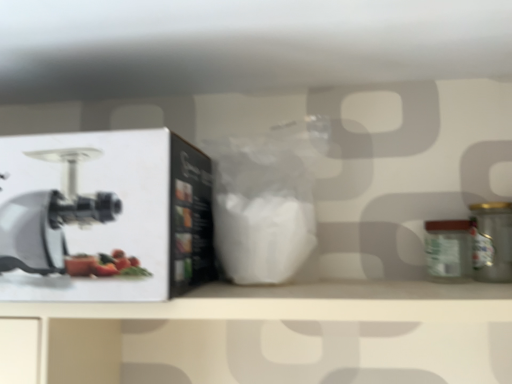
Question: Is metallic gold canister at right situated inside white matte box at left or outside?

Choices:
 (A) outside
 (B) inside

Answer: (A)

Question: From the image's perspective, is metallic gold canister at right positioned above or below white matte box at left?

Choices:
 (A) above
 (B) below

Answer: (B)

Question: Estimate the real-world distances between objects in this image. Which object is farther from the metallic gold canister at right?

Choices:
 (A) green matte glass jar at right
 (B) white matte box at left

Answer: (B)

Question: Which object is the farthest from the green matte glass jar at right?

Choices:
 (A) metallic gold canister at right
 (B) white matte box at left

Answer: (B)